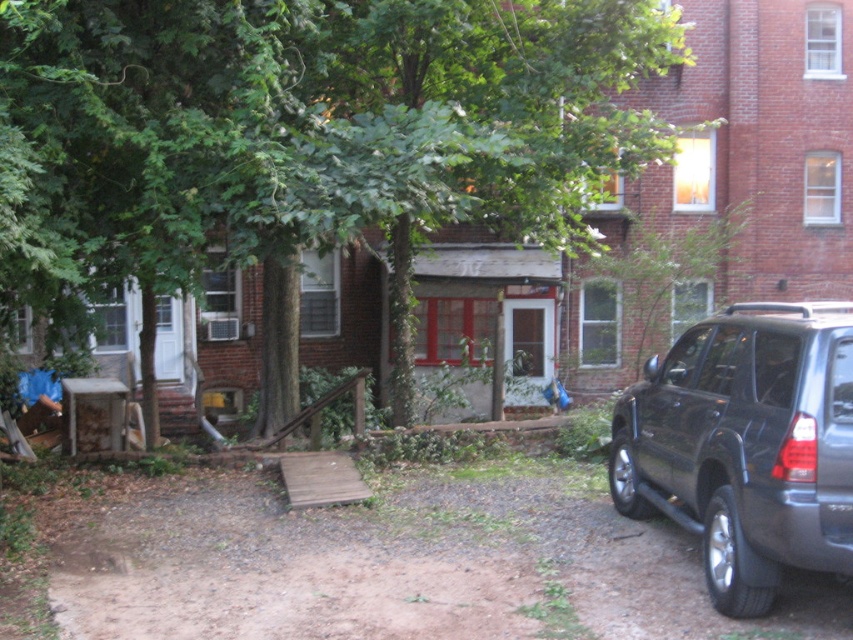
You are standing in front of the brick building and want to walk from the entrance ramp to the parked SUV. Which point, point (73,35) or point (158,499), is closer to your current position?

Point (73,35) is closer to the viewer than point (158,499), so it is closer to your current position.

You are a delivery driver trying to park your truck next to the shiny dark gray suv at right. The brown gravel driveway at lower right is available. Is the driveway to the left or right side of the SUV?

The brown gravel driveway at lower right is to the left of the shiny dark gray suv at right, so the driveway is on the left side of the SUV.